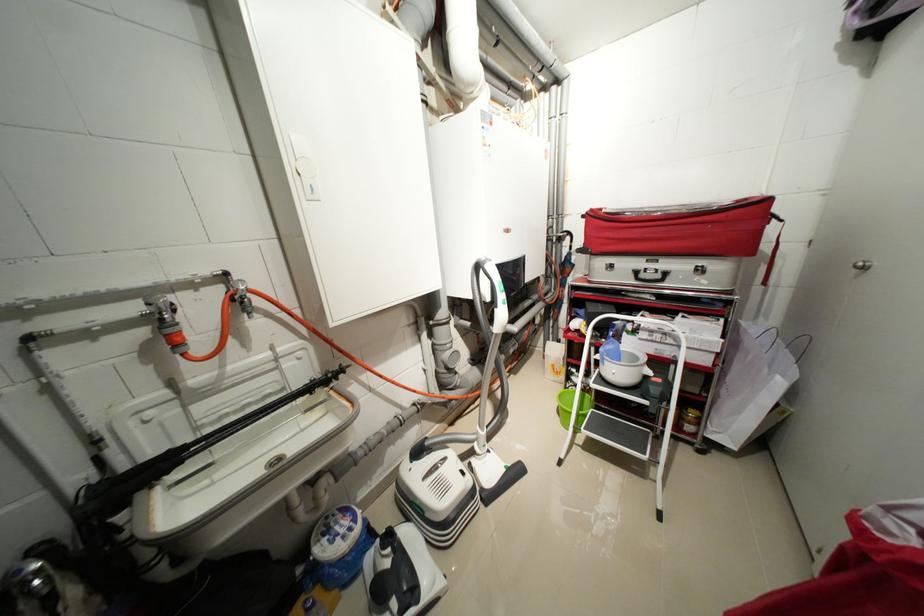
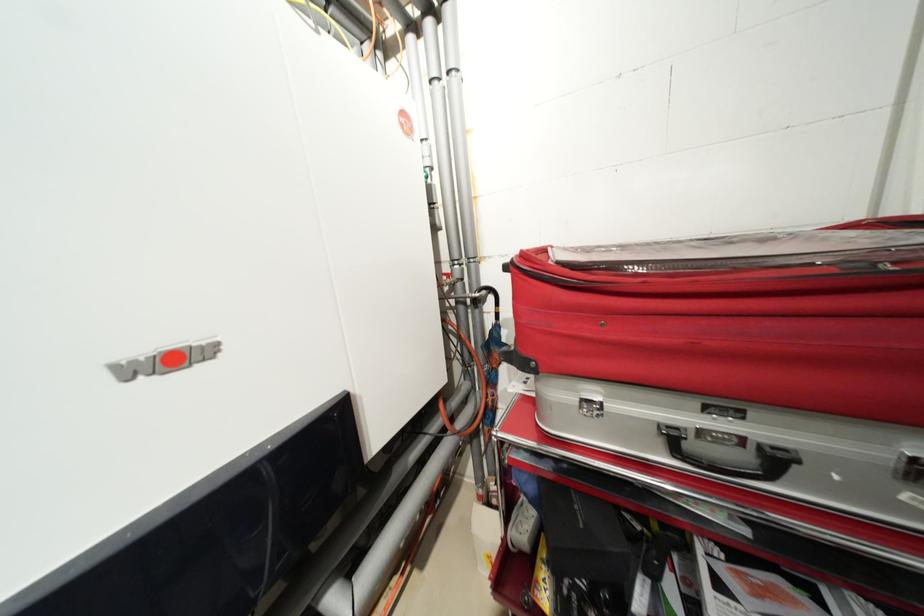
Which direction would the cameraman need to move to produce the second image?

The cameraman moved toward right, forward.